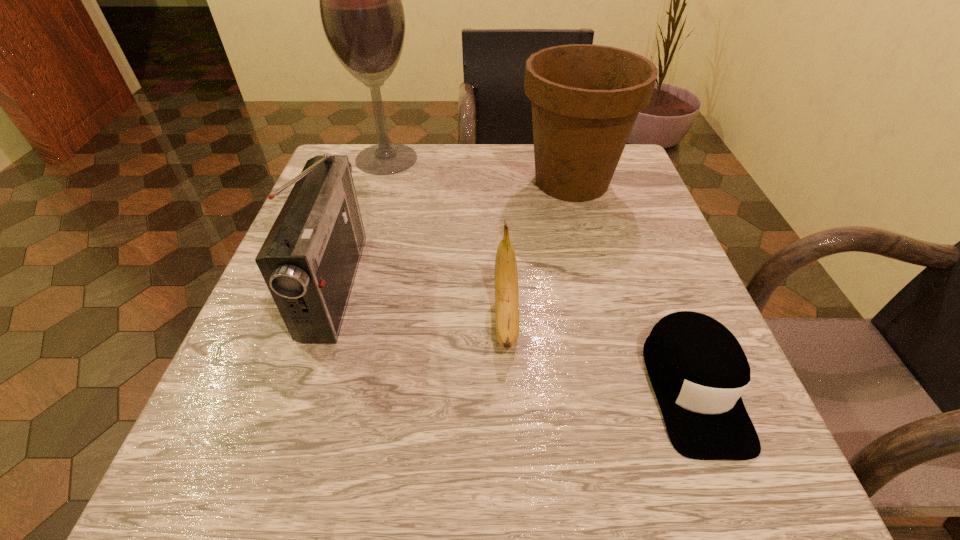
What are the coordinates of `free region at the far edge` in the screenshot? It's located at (529, 147).

This screenshot has height=540, width=960. I want to click on free space at the left edge of the desktop, so click(x=296, y=415).

Find the location of a particular element. vacant space at the right edge is located at coordinates (606, 232).

Image resolution: width=960 pixels, height=540 pixels. What are the coordinates of `free space at the far left corner of the desktop` in the screenshot? It's located at (342, 143).

The width and height of the screenshot is (960, 540). In order to click on vacant space at the near left corner of the desktop in this screenshot , I will do `click(308, 469)`.

You are a GUI agent. You are given a task and a screenshot of the screen. Output one action in this format:
    pyautogui.click(x=<x>, y=<y>)
    Task: Click on the vacant space that's between the tallest object and the shortest object
    
    Given the screenshot: What is the action you would take?
    pyautogui.click(x=540, y=274)

You are a GUI agent. You are given a task and a screenshot of the screen. Output one action in this format:
    pyautogui.click(x=<x>, y=<y>)
    Task: Click on the empty space that is in between the third object from right to left and the radio receiver
    
    Given the screenshot: What is the action you would take?
    pyautogui.click(x=420, y=302)

Identify the location of vacant area that lies between the cap and the flowerpot. (632, 285).

This screenshot has width=960, height=540. I want to click on free spot between the flowerpot and the third object from right to left, so click(x=540, y=251).

You are a GUI agent. You are given a task and a screenshot of the screen. Output one action in this format:
    pyautogui.click(x=<x>, y=<y>)
    Task: Click on the blank region between the radio receiver and the banana
    This screenshot has height=540, width=960.
    Given the screenshot: What is the action you would take?
    pyautogui.click(x=420, y=302)